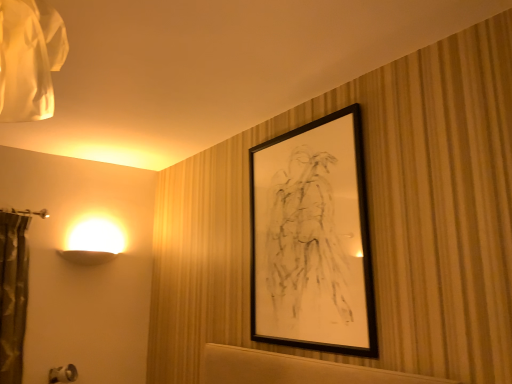
Describe the element at coordinates (312, 239) in the screenshot. I see `black matte picture frame at upper center` at that location.

Locate an element on the screen. The height and width of the screenshot is (384, 512). black matte picture frame at upper center is located at coordinates (312, 239).

Where is `black matte picture frame at upper center`? The image size is (512, 384). black matte picture frame at upper center is located at coordinates (312, 239).